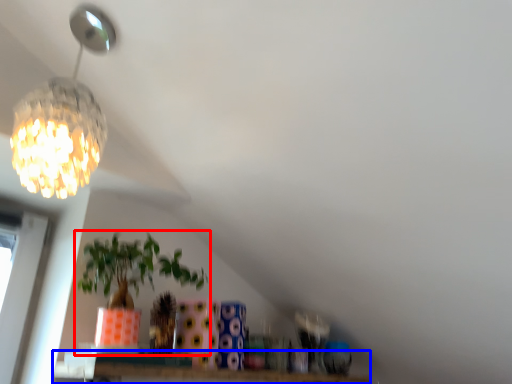
Question: Among these objects, which one is nearest to the camera, houseplant (highlighted by a red box) or window (highlighted by a blue box)?

Choices:
 (A) houseplant
 (B) window

Answer: (A)